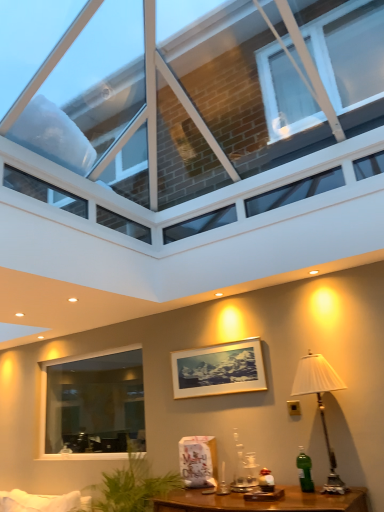
Identify the location of vacant area on top of gold-framed picture at center (from a real-world perspective). pos(212,344).